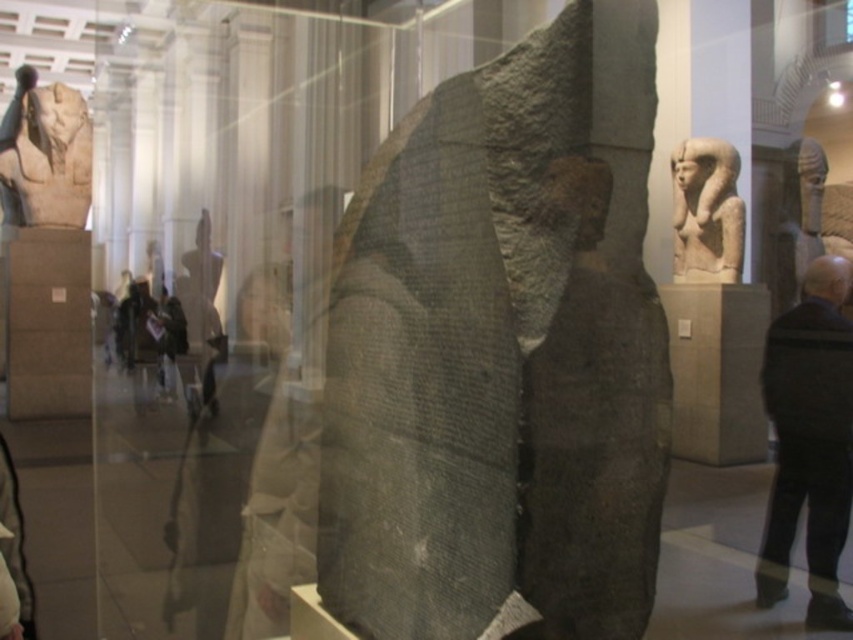
Does matte stone statue at upper left appear on the left side of light beige stone statue at upper right?

Yes, matte stone statue at upper left is to the left of light beige stone statue at upper right.

Based on the photo, who is lower down, matte stone statue at upper left or light beige stone statue at upper right?

light beige stone statue at upper right is below.

Describe the element at coordinates (47, 152) in the screenshot. I see `matte stone statue at upper left` at that location.

Identify the location of matte stone statue at upper left. The height and width of the screenshot is (640, 853). (47, 152).

Can you confirm if light beige fabric at center is smaller than matte stone statue at upper left?

Correct, light beige fabric at center occupies less space than matte stone statue at upper left.

Consider the image. Which is below, light beige fabric at center or matte stone statue at upper left?

light beige fabric at center is below.

Identify the location of light beige fabric at center. This screenshot has width=853, height=640. (238, 486).

How much distance is there between light beige fabric at center and light beige stone statue at upper right?

4.69 meters

Looking at this image, does light beige fabric at center have a greater width compared to light beige stone statue at upper right?

No, light beige fabric at center is not wider than light beige stone statue at upper right.

Between point (280, 310) and point (729, 193), which one is positioned in front?

Point (729, 193) is in front.

Find the location of a particular element. The image size is (853, 640). light beige fabric at center is located at coordinates (238, 486).